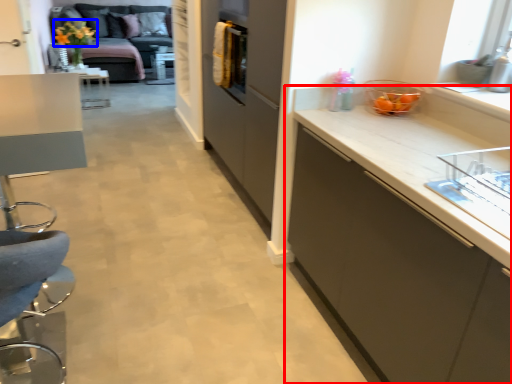
Question: Which object is closer to the camera taking this photo, cabinetry (highlighted by a red box) or flower (highlighted by a blue box)?

Choices:
 (A) cabinetry
 (B) flower

Answer: (A)